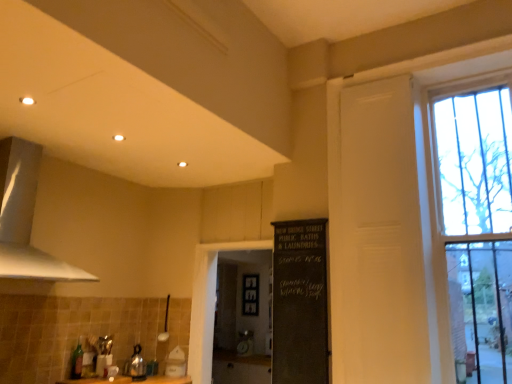
Question: Is black chalkboard at center a part of green glass bottle at lower left?

Choices:
 (A) yes
 (B) no

Answer: (B)

Question: From the image's perspective, does green glass bottle at lower left appear higher than black chalkboard at center?

Choices:
 (A) yes
 (B) no

Answer: (B)

Question: Is green glass bottle at lower left at the left side of black chalkboard at center?

Choices:
 (A) yes
 (B) no

Answer: (A)

Question: Does green glass bottle at lower left turn towards black chalkboard at center?

Choices:
 (A) no
 (B) yes

Answer: (A)

Question: Considering the relative sizes of green glass bottle at lower left and black chalkboard at center in the image provided, is green glass bottle at lower left bigger than black chalkboard at center?

Choices:
 (A) no
 (B) yes

Answer: (A)

Question: Does point (17, 203) appear closer or farther from the camera than point (464, 72)?

Choices:
 (A) farther
 (B) closer

Answer: (B)

Question: From the image's perspective, is white matte exhaust hood at upper left located above or below white painted wood window at upper right?

Choices:
 (A) below
 (B) above

Answer: (B)

Question: Is white matte exhaust hood at upper left bigger or smaller than white painted wood window at upper right?

Choices:
 (A) small
 (B) big

Answer: (B)

Question: Is white matte exhaust hood at upper left wider or thinner than white painted wood window at upper right?

Choices:
 (A) wide
 (B) thin

Answer: (A)

Question: In the image, is green glass bottle at lower left positioned in front of or behind black chalkboard at center, which is the 2th screen door in right-to-left order?

Choices:
 (A) front
 (B) behind

Answer: (A)

Question: From a real-world perspective, is green glass bottle at lower left above or below black chalkboard at center, the 1th screen door viewed from the left?

Choices:
 (A) above
 (B) below

Answer: (B)

Question: Is green glass bottle at lower left inside or outside of black chalkboard at center, the 1th screen door viewed from the left?

Choices:
 (A) inside
 (B) outside

Answer: (B)

Question: From the image's perspective, relative to black chalkboard at center, which is the 1th screen door in back-to-front order, is green glass bottle at lower left above or below?

Choices:
 (A) above
 (B) below

Answer: (B)

Question: From their relative heights in the image, would you say smooth wooden counter top at center is taller or shorter than green glass bottle at lower left?

Choices:
 (A) short
 (B) tall

Answer: (B)

Question: Is point (265, 375) closer or farther from the camera than point (74, 350)?

Choices:
 (A) farther
 (B) closer

Answer: (A)